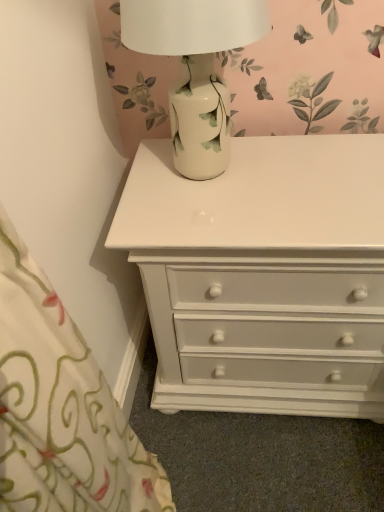
Identify the location of vacant area to the right of porcelain vase at upper center. (321, 167).